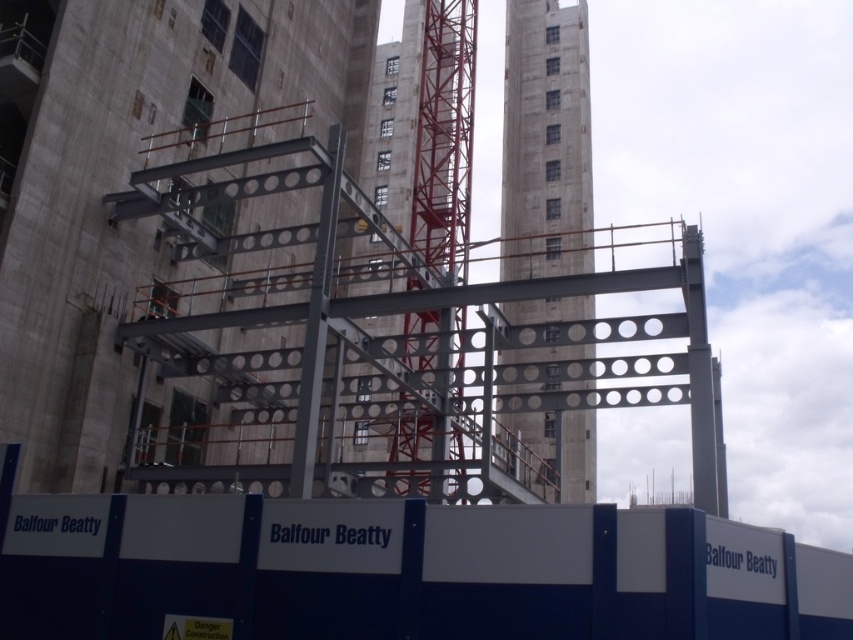
Question: Is concrete tower at center smaller than red metal crane at center?

Choices:
 (A) yes
 (B) no

Answer: (B)

Question: Does concrete tower at center appear over red metal crane at center?

Choices:
 (A) no
 (B) yes

Answer: (B)

Question: Which object is closer to the camera taking this photo?

Choices:
 (A) concrete tower at center
 (B) metallic gray steel frame at center

Answer: (A)

Question: Can you confirm if metallic gray steel frame at center is smaller than red metal crane at center?

Choices:
 (A) no
 (B) yes

Answer: (B)

Question: Which point is farther from the camera taking this photo?

Choices:
 (A) (448, 256)
 (B) (183, 35)

Answer: (A)

Question: Which point appears farthest from the camera in this image?

Choices:
 (A) (572, 99)
 (B) (426, 52)
 (C) (129, 58)

Answer: (A)